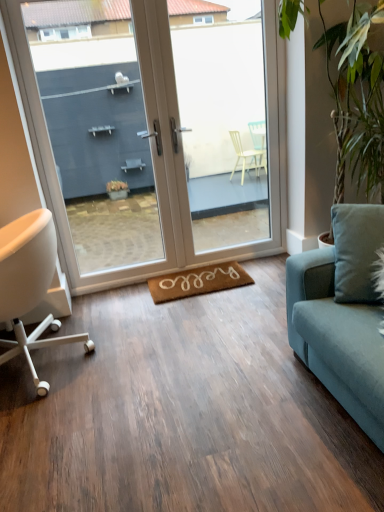
Question: Considering the relative positions of transparent glass door at center and white matte chair at left in the image provided, is transparent glass door at center to the left of white matte chair at left from the viewer's perspective?

Choices:
 (A) yes
 (B) no

Answer: (B)

Question: Can you confirm if transparent glass door at center is positioned to the right of white matte chair at left?

Choices:
 (A) no
 (B) yes

Answer: (B)

Question: Considering the relative positions of transparent glass door at center and white matte chair at left in the image provided, is transparent glass door at center behind white matte chair at left?

Choices:
 (A) yes
 (B) no

Answer: (A)

Question: Is transparent glass door at center far away from white matte chair at left?

Choices:
 (A) yes
 (B) no

Answer: (A)

Question: Is transparent glass door at center not inside white matte chair at left?

Choices:
 (A) no
 (B) yes

Answer: (B)

Question: Relative to brown coir yoga mat at center, is green leafy plant at right in front or behind?

Choices:
 (A) behind
 (B) front

Answer: (B)

Question: Looking at their shapes, would you say green leafy plant at right is wider or thinner than brown coir yoga mat at center?

Choices:
 (A) wide
 (B) thin

Answer: (A)

Question: From the image's perspective, is green leafy plant at right located above or below brown coir yoga mat at center?

Choices:
 (A) below
 (B) above

Answer: (B)

Question: Based on their sizes in the image, would you say green leafy plant at right is bigger or smaller than brown coir yoga mat at center?

Choices:
 (A) small
 (B) big

Answer: (B)

Question: Is transparent glass door at center wider or thinner than white glossy door at center?

Choices:
 (A) thin
 (B) wide

Answer: (B)

Question: From the image's perspective, is transparent glass door at center positioned above or below white glossy door at center?

Choices:
 (A) above
 (B) below

Answer: (A)

Question: Would you say transparent glass door at center is to the left or to the right of white glossy door at center in the picture?

Choices:
 (A) right
 (B) left

Answer: (A)

Question: From a real-world perspective, is transparent glass door at center positioned above or below white glossy door at center?

Choices:
 (A) below
 (B) above

Answer: (A)

Question: Is white matte chair at left spatially inside brown coir yoga mat at center, or outside of it?

Choices:
 (A) inside
 (B) outside

Answer: (B)

Question: Is white matte chair at left bigger or smaller than brown coir yoga mat at center?

Choices:
 (A) small
 (B) big

Answer: (B)